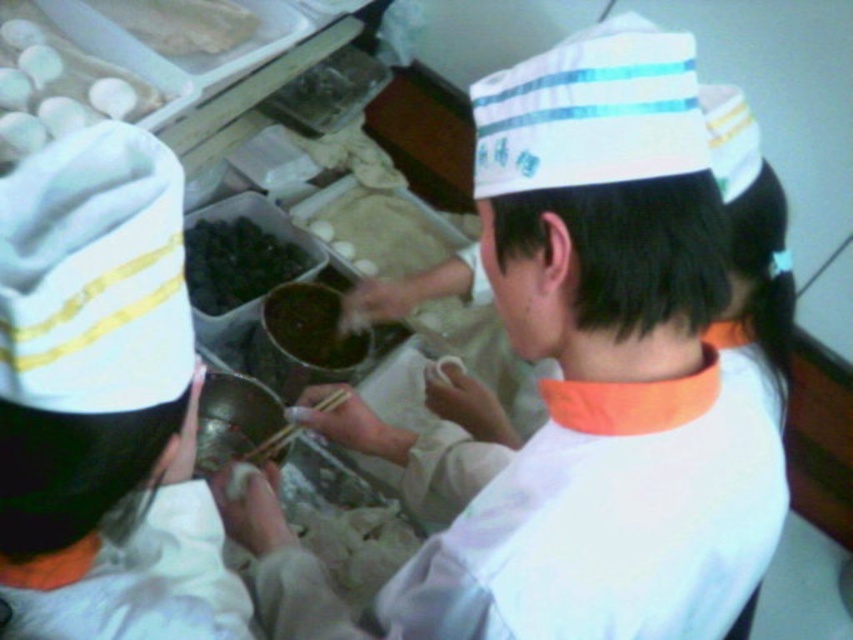
Consider the image. You are a chef in the kitchen and need to retrieve an egg from the white matte eggs at upper left without touching the white fabric shirt at center. Is this possible given their positions?

The white fabric shirt at center is to the right of the white matte eggs at upper left, so you can reach the white matte eggs at upper left without touching the white fabric shirt at center by moving to the left side of the shirt.

What is located at the coordinates point (238, 262) in the image?

The point (238, 262) marks the location of the black glossy food at center.